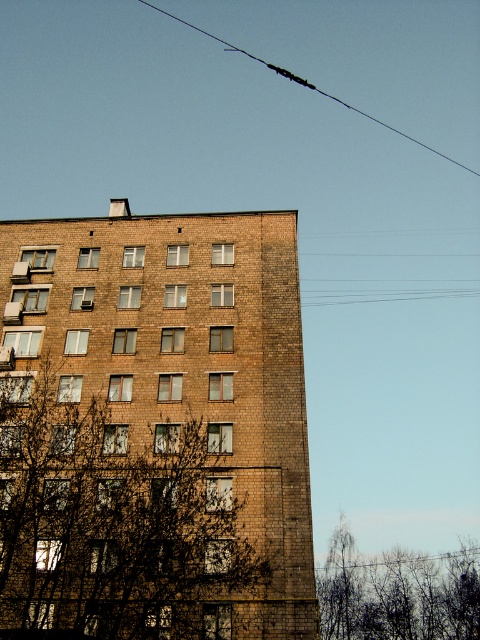
Question: Can you confirm if brown brick building at center is positioned below black wire at upper center?

Choices:
 (A) yes
 (B) no

Answer: (A)

Question: Can you confirm if bare branches at lower right is positioned below black wire at upper center?

Choices:
 (A) no
 (B) yes

Answer: (B)

Question: Considering the relative positions of brown brick building at center and bare branches at lower right in the image provided, where is brown brick building at center located with respect to bare branches at lower right?

Choices:
 (A) left
 (B) right

Answer: (A)

Question: Which point is farther to the camera?

Choices:
 (A) black wire at upper center
 (B) brown brick building at center

Answer: (A)

Question: Which of these objects is positioned closest to the brown brick building at center?

Choices:
 (A) bare branches at lower right
 (B) black wire at upper center

Answer: (A)

Question: Estimate the real-world distances between objects in this image. Which object is closer to the bare branches at lower right?

Choices:
 (A) black wire at upper center
 (B) brown brick building at center

Answer: (B)